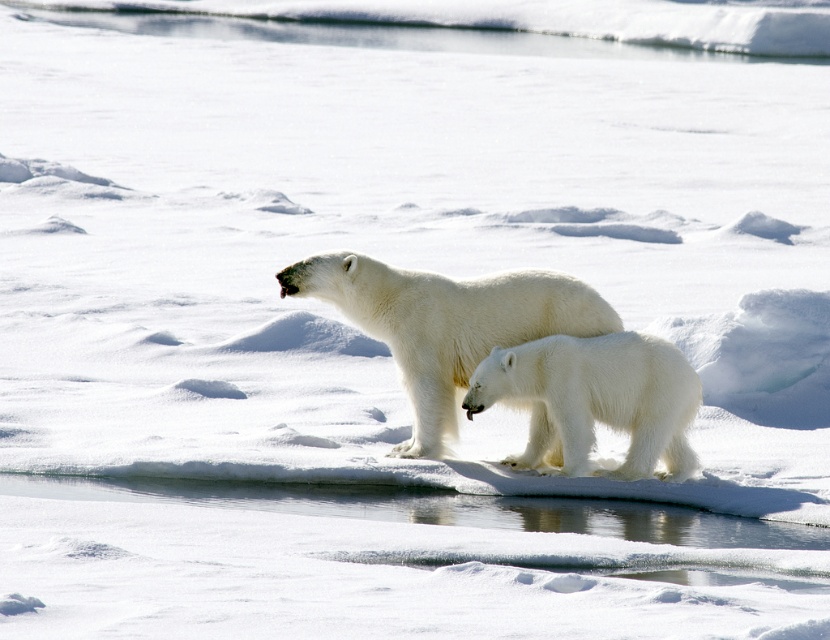
Can you confirm if white fur polar bear at center is wider than white fluffy polar bear at center?

Yes.

Find the location of a particular element. white fur polar bear at center is located at coordinates (445, 323).